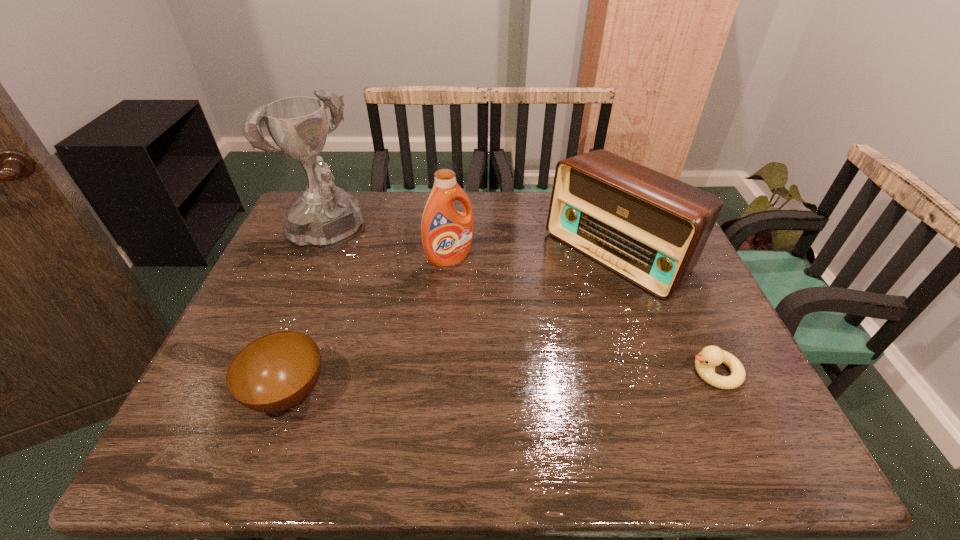
Identify the location of radio receiver situated at the far edge. (649, 228).

Where is `bowl at the near edge`? This screenshot has height=540, width=960. bowl at the near edge is located at coordinates (274, 373).

Where is `duckling that is at the near edge`? The width and height of the screenshot is (960, 540). duckling that is at the near edge is located at coordinates (710, 356).

The height and width of the screenshot is (540, 960). I want to click on bowl that is at the left edge, so pyautogui.click(x=274, y=373).

The image size is (960, 540). I want to click on award located in the left edge section of the desktop, so click(326, 216).

Find the location of a particular element. The image size is (960, 540). duckling that is at the right edge is located at coordinates (710, 356).

I want to click on radio receiver that is positioned at the right edge, so click(649, 228).

Find the location of a particular element. This screenshot has width=960, height=540. object present at the far left corner is located at coordinates (326, 216).

The height and width of the screenshot is (540, 960). I want to click on object at the near left corner, so click(x=274, y=373).

Locate an element on the screen. object situated at the far right corner is located at coordinates (649, 228).